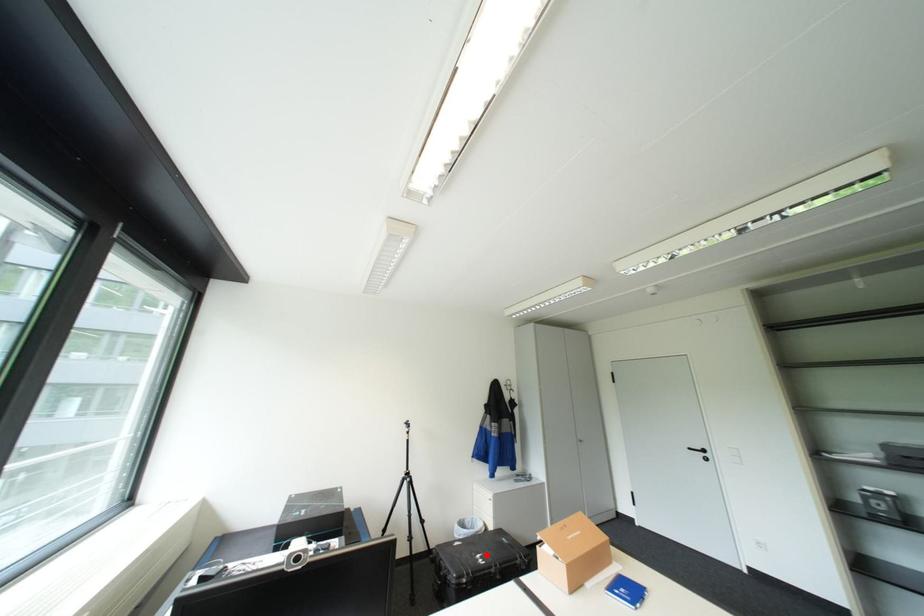
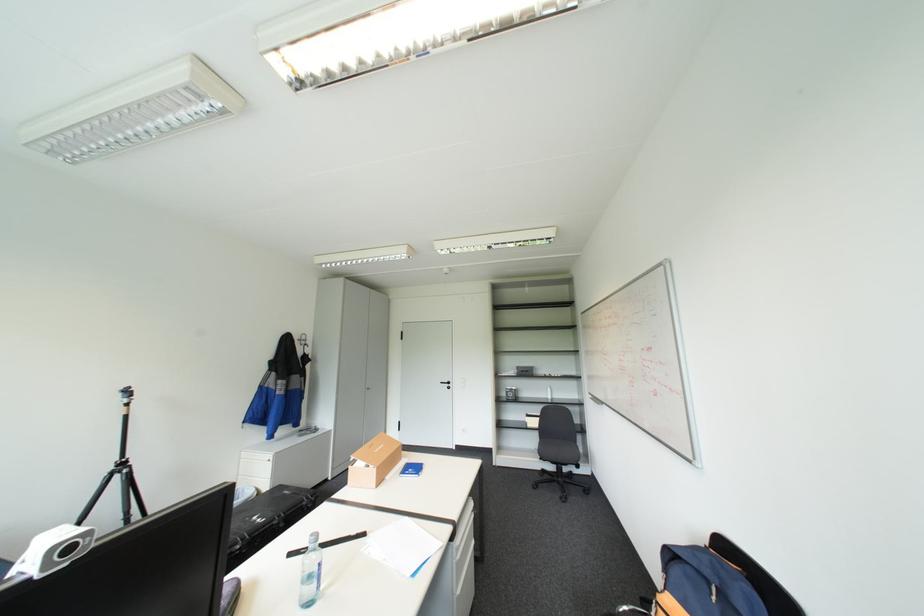
Question: A red point is marked in image1. In image2, is the corresponding 3D point closer to the camera or farther? Reply with the corresponding letter.

Choices:
 (A) The corresponding 3D point is closer.
 (B) The corresponding 3D point is farther.

Answer: (B)